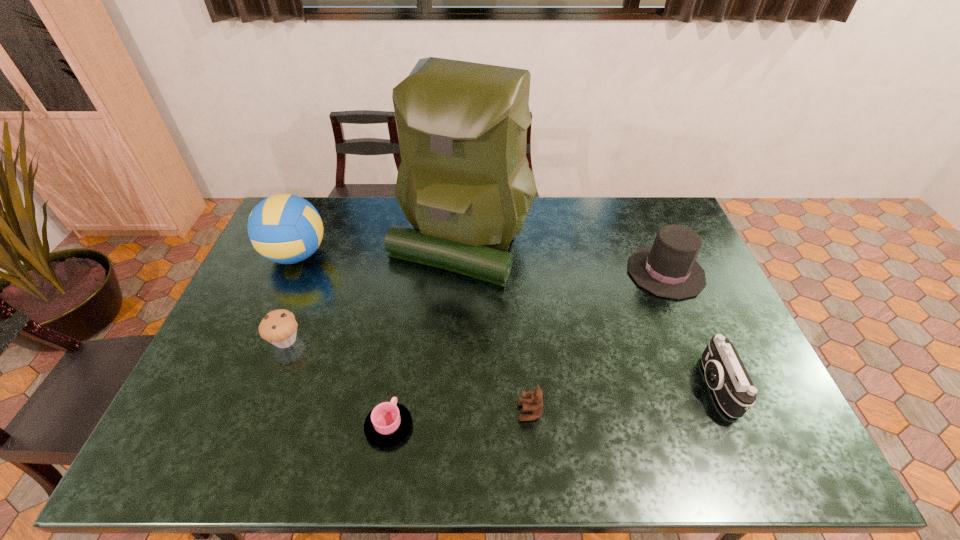
The width and height of the screenshot is (960, 540). In order to click on vacant point located on the side with the handle of the shortest object in this screenshot , I will do `click(408, 305)`.

You are a GUI agent. You are given a task and a screenshot of the screen. Output one action in this format:
    pyautogui.click(x=<x>, y=<y>)
    Task: Click on the vacant space located 0.310m on the side with the handle of the shortest object
    
    Given the screenshot: What is the action you would take?
    pyautogui.click(x=407, y=310)

You are a GUI agent. You are given a task and a screenshot of the screen. Output one action in this format:
    pyautogui.click(x=<x>, y=<y>)
    Task: Click on the backpack located in the far edge section of the desktop
    
    Given the screenshot: What is the action you would take?
    pyautogui.click(x=464, y=183)

You are a GUI agent. You are given a task and a screenshot of the screen. Output one action in this format:
    pyautogui.click(x=<x>, y=<y>)
    Task: Click on the volleyball present at the far edge
    The image size is (960, 540).
    Given the screenshot: What is the action you would take?
    pyautogui.click(x=284, y=228)

Locate an element on the screen. The image size is (960, 540). object that is at the near edge is located at coordinates (389, 423).

Where is `volleyball that is at the left edge`? volleyball that is at the left edge is located at coordinates (284, 228).

The width and height of the screenshot is (960, 540). In order to click on muffin that is at the left edge in this screenshot , I will do `click(279, 327)`.

This screenshot has width=960, height=540. Identify the location of dress hat located in the right edge section of the desktop. (668, 269).

Identify the location of camera that is at the right edge. The width and height of the screenshot is (960, 540). (725, 373).

I want to click on object at the far left corner, so click(284, 228).